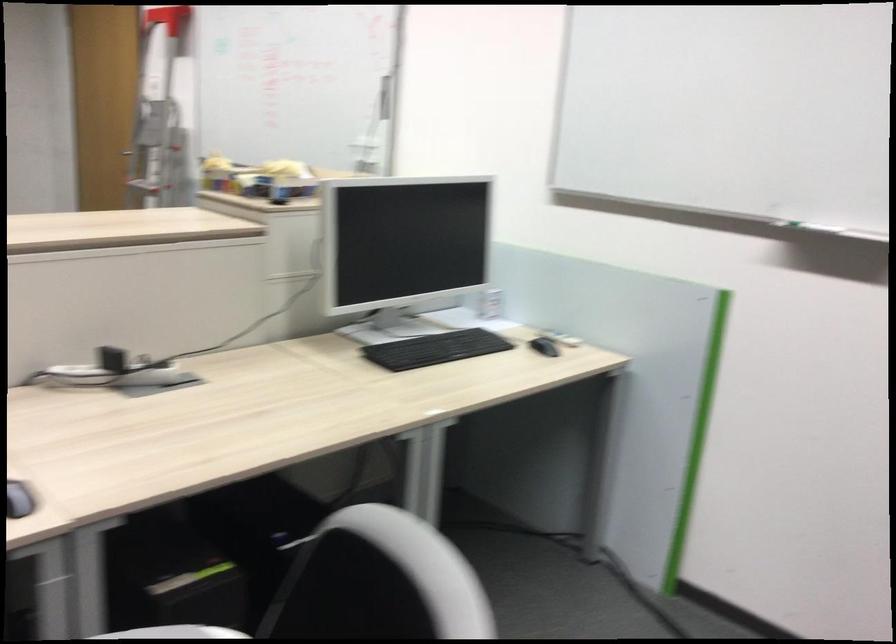
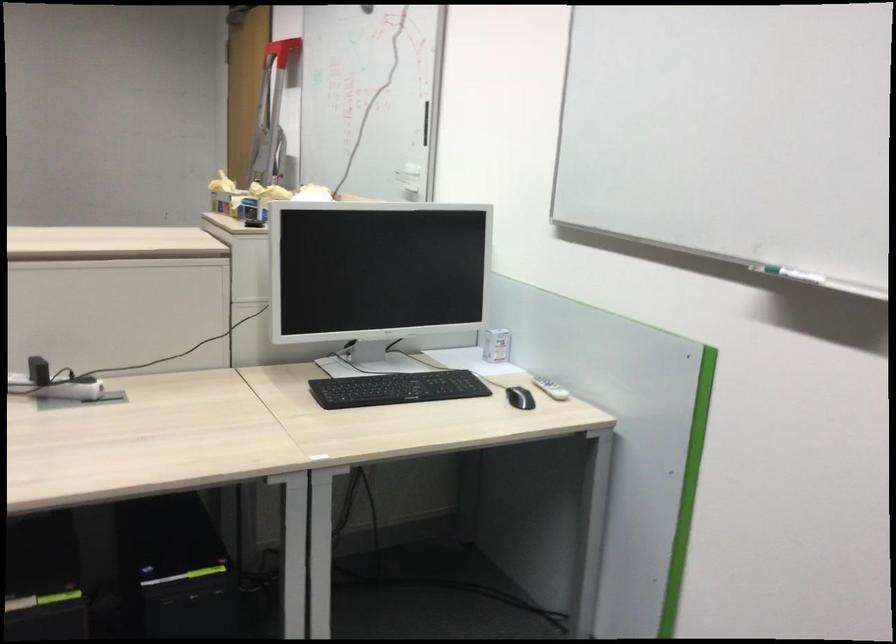
The point at (110, 372) is marked in the first image. Where is the corresponding point in the second image?

(53, 383)